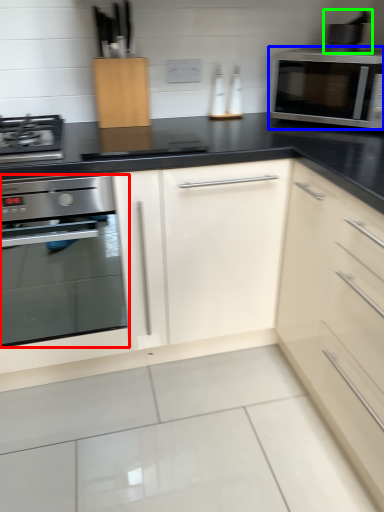
Question: Based on their relative distances, which object is nearer to oven (highlighted by a red box)? Choose from microwave oven (highlighted by a blue box) and appliance (highlighted by a green box).

Choices:
 (A) microwave oven
 (B) appliance

Answer: (A)